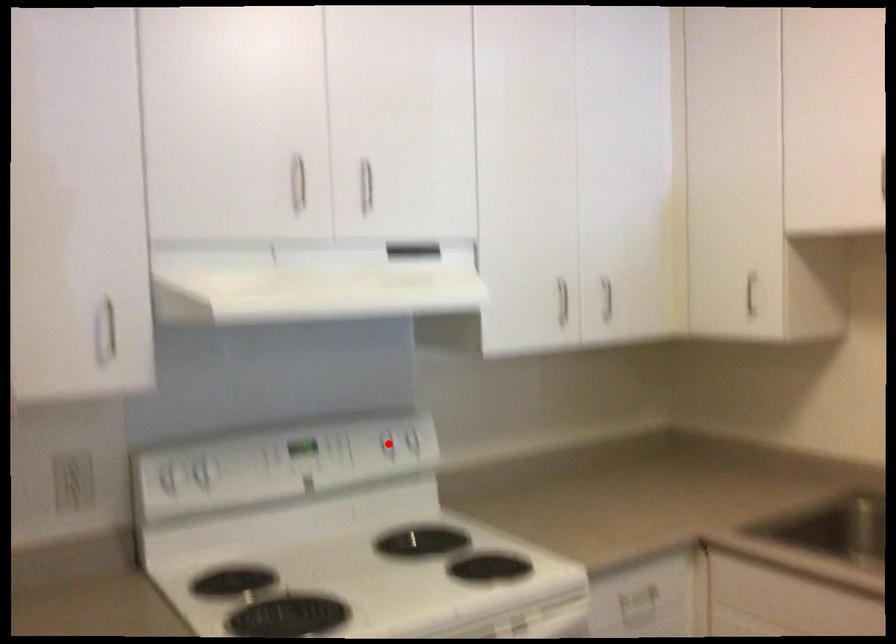
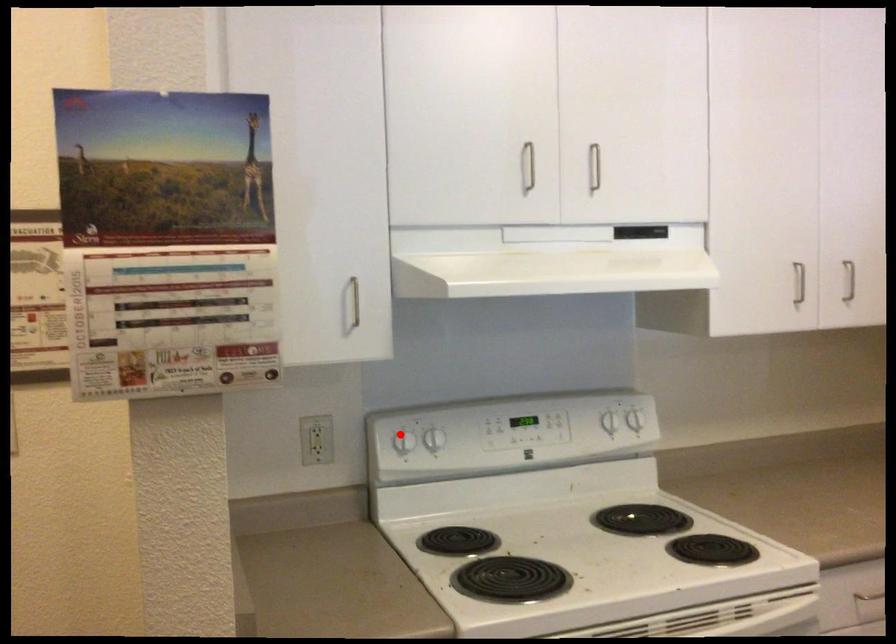
I am providing you with two images of the same scene from different viewpoints. A red point is marked on the first image and another point is marked on the second image. Does the point marked in image1 correspond to the same location as the one in image2?

No